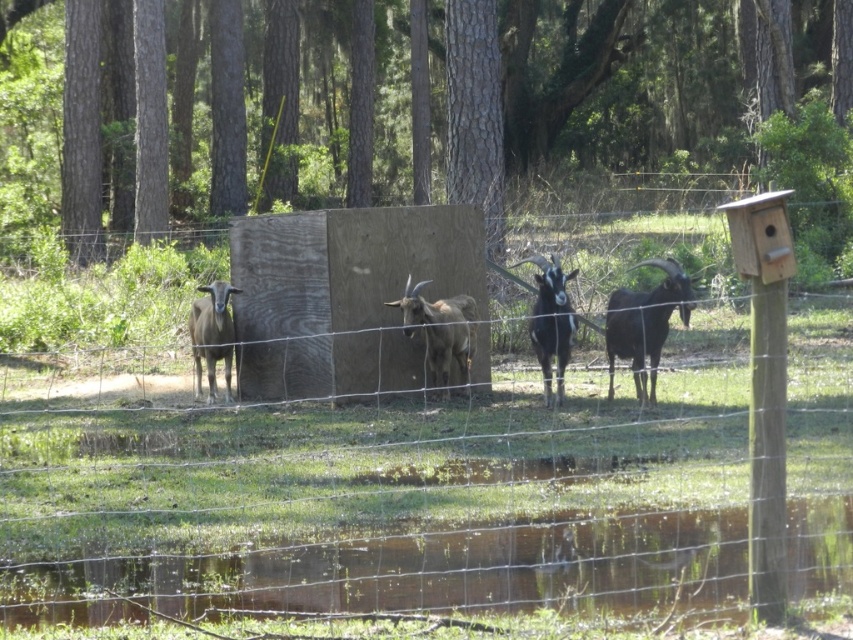
I want to click on brown woolen goat at center, so click(x=440, y=330).

In the scene shown: Is brown woolen goat at center taller than brown woolly goat at left?

Incorrect, brown woolen goat at center's height is not larger of brown woolly goat at left's.

Image resolution: width=853 pixels, height=640 pixels. What do you see at coordinates (440, 330) in the screenshot? I see `brown woolen goat at center` at bounding box center [440, 330].

This screenshot has width=853, height=640. I want to click on brown woolen goat at center, so click(440, 330).

Measure the distance from black woolen goat at center to brown woolly goat at left.

2.93 meters

Who is more distant from viewer, (567, 339) or (230, 289)?

The point (230, 289) is behind.

Does point (550, 301) come in front of point (202, 342)?

Yes.

At what (x,y) coordinates should I click in order to perform the action: click on black woolen goat at center. Please return your answer as a coordinate pair (x, y). This screenshot has width=853, height=640. Looking at the image, I should click on (550, 321).

Which is more to the right, black woolly goat at right or black woolen goat at center?

From the viewer's perspective, black woolly goat at right appears more on the right side.

This screenshot has width=853, height=640. I want to click on black woolly goat at right, so click(x=645, y=323).

Where is `black woolly goat at right`? This screenshot has height=640, width=853. black woolly goat at right is located at coordinates (645, 323).